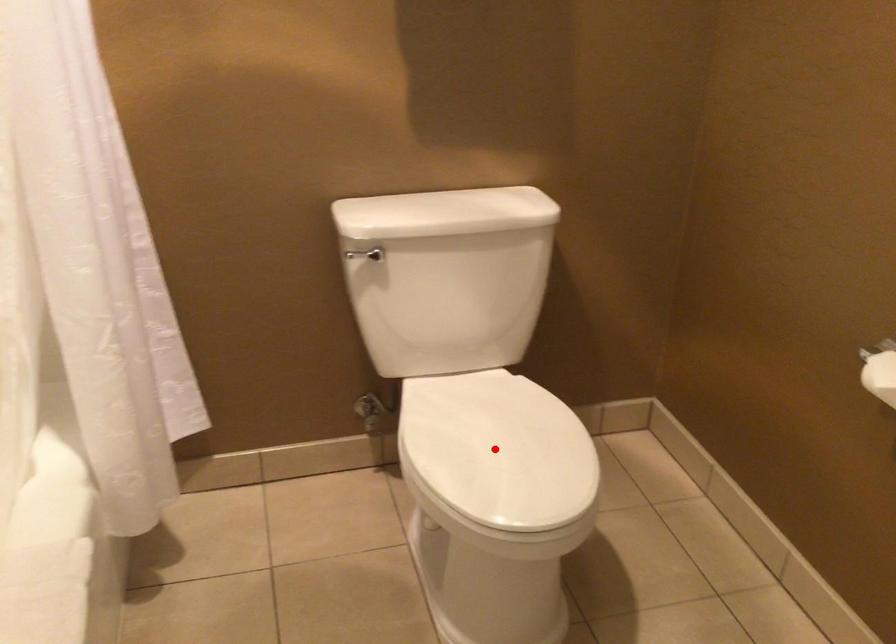
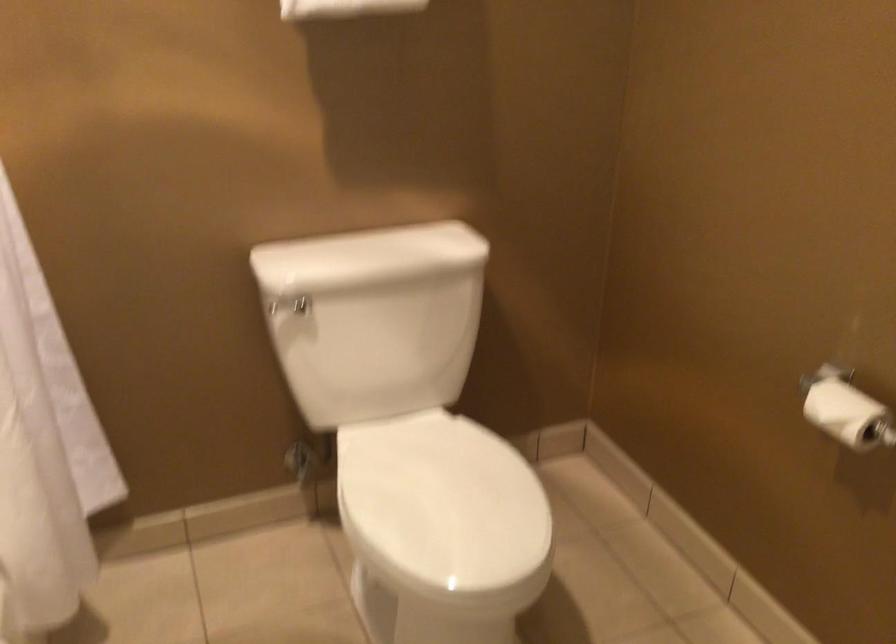
In the second image, find the point that corresponds to the highlighted location in the first image.

(442, 505)